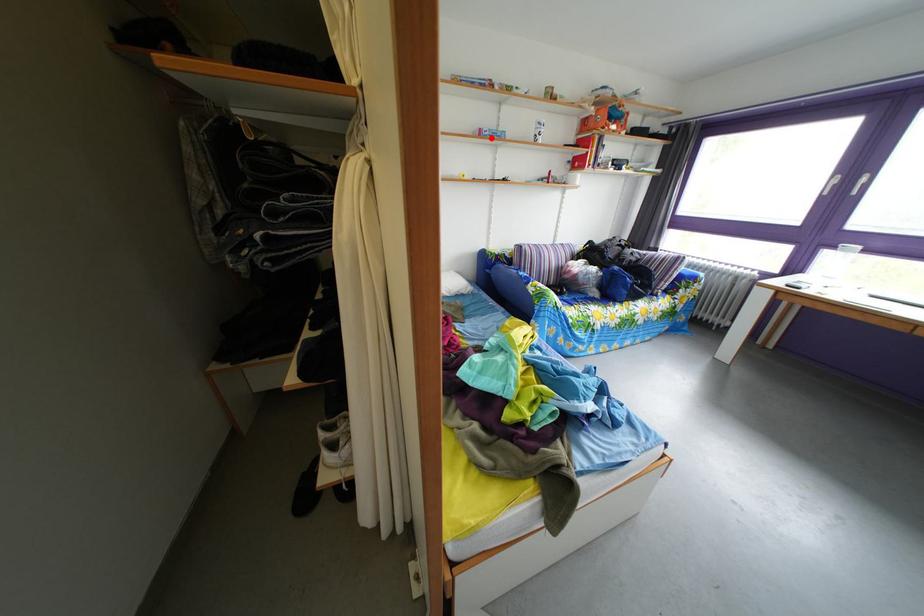
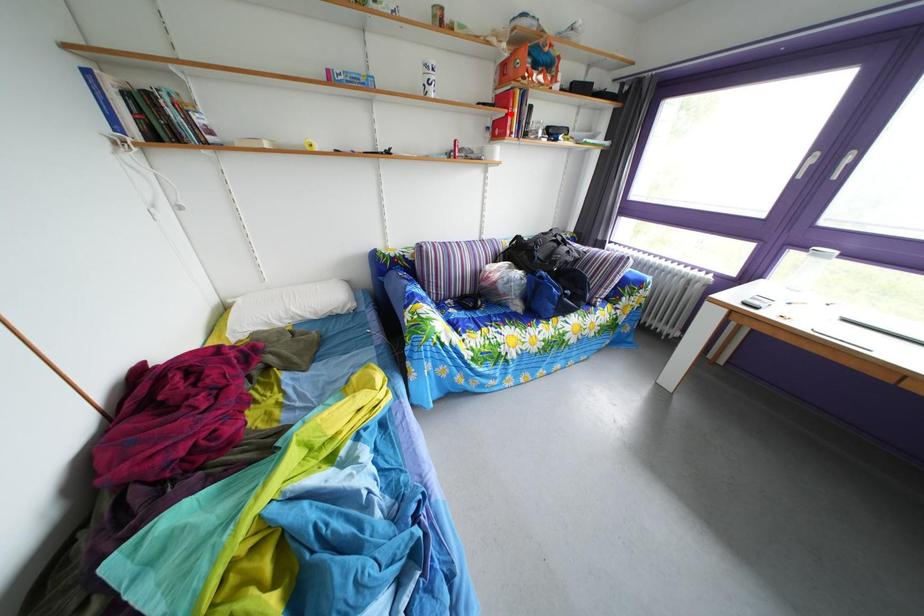
I am providing you with two images of the same scene from different viewpoints. A red point is marked on the first image and another point is marked on the second image. Is the marked point in image1 the same physical position as the marked point in image2?

No